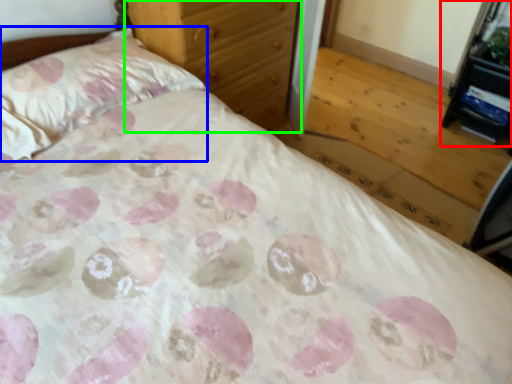
Question: Considering the real-world distances, which object is closest to vanity (highlighted by a red box)? pillow (highlighted by a blue box) or chest of drawers (highlighted by a green box).

Choices:
 (A) pillow
 (B) chest of drawers

Answer: (B)